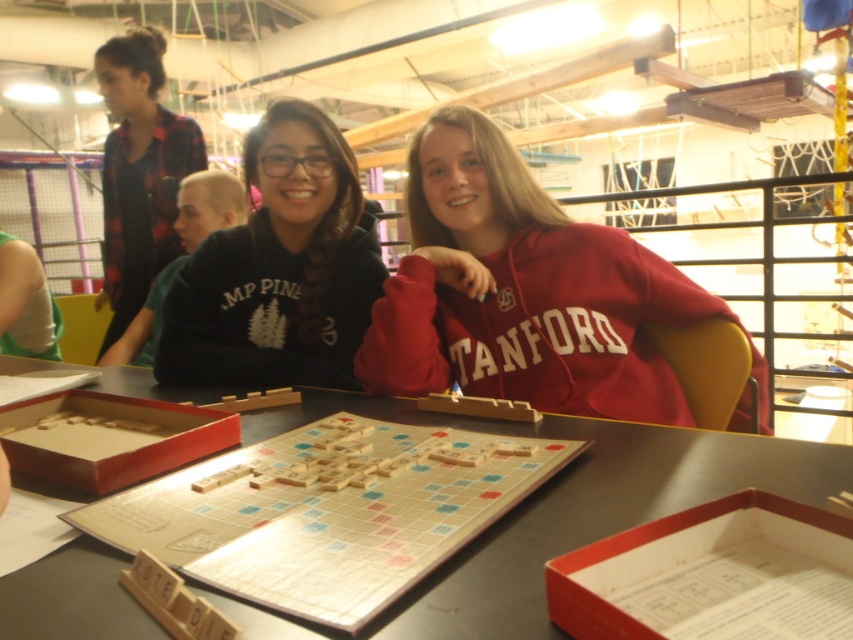
Question: Which object appears closest to the camera in this image?

Choices:
 (A) black matte sweatshirt at center
 (B) red matte stanford hoodie at center
 (C) wooden scrabble board at center

Answer: (C)

Question: Considering the real-world distances, which object is farthest from the wooden scrabble board at center?

Choices:
 (A) black matte sweatshirt at center
 (B) red matte stanford hoodie at center

Answer: (B)

Question: Observing the image, what is the correct spatial positioning of wooden scrabble board at center in reference to black matte sweatshirt at center?

Choices:
 (A) above
 (B) below

Answer: (B)

Question: Is red matte stanford hoodie at center smaller than black matte sweatshirt at center?

Choices:
 (A) yes
 (B) no

Answer: (B)

Question: Can you confirm if wooden scrabble board at center is positioned to the left of black matte sweatshirt at center?

Choices:
 (A) no
 (B) yes

Answer: (A)

Question: Which point is farther from the camera taking this photo?

Choices:
 (A) (323, 236)
 (B) (456, 166)

Answer: (A)